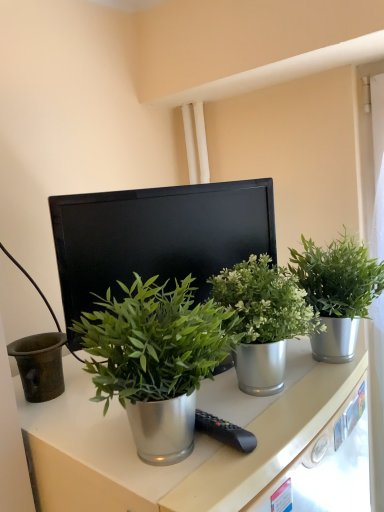
Question: From a real-world perspective, is green metallic plant at center, which is counted as the 3th houseplant, starting from the right, positioned over green metallic plant at center, which ranks as the third houseplant in left-to-right order, based on gravity?

Choices:
 (A) no
 (B) yes

Answer: (A)

Question: Is green metallic plant at center, which ranks as the first houseplant in left-to-right order, not close to green metallic plant at center, which ranks as the third houseplant in left-to-right order?

Choices:
 (A) yes
 (B) no

Answer: (B)

Question: Is green metallic plant at center, which is counted as the 3th houseplant, starting from the right, thinner than green metallic plant at center, which is the first houseplant from right to left?

Choices:
 (A) no
 (B) yes

Answer: (B)

Question: Is green metallic plant at center, which ranks as the first houseplant in left-to-right order, looking in the opposite direction of green metallic plant at center, which ranks as the third houseplant in left-to-right order?

Choices:
 (A) yes
 (B) no

Answer: (B)

Question: From a real-world perspective, is green metallic plant at center, which ranks as the first houseplant in left-to-right order, located beneath green metallic plant at center, which is the first houseplant from right to left?

Choices:
 (A) yes
 (B) no

Answer: (A)

Question: Based on their positions, is green metallic plant at center, which ranks as the third houseplant in left-to-right order, located to the left or right of black matte computer monitor at center?

Choices:
 (A) left
 (B) right

Answer: (B)

Question: Is green metallic plant at center, which is the first houseplant from right to left, situated inside black matte computer monitor at center or outside?

Choices:
 (A) outside
 (B) inside

Answer: (A)

Question: Is point (342, 254) closer or farther from the camera than point (84, 226)?

Choices:
 (A) closer
 (B) farther

Answer: (B)

Question: Looking at their shapes, would you say green metallic plant at center, which ranks as the third houseplant in left-to-right order, is wider or thinner than black matte computer monitor at center?

Choices:
 (A) wide
 (B) thin

Answer: (A)

Question: Considering the positions of metallic drawer at lower right and metallic green plant at center, which is counted as the 2th houseplant, starting from the left, in the image, is metallic drawer at lower right wider or thinner than metallic green plant at center, which is counted as the 2th houseplant, starting from the left,?

Choices:
 (A) thin
 (B) wide

Answer: (A)

Question: In terms of height, does metallic drawer at lower right look taller or shorter compared to metallic green plant at center, the second houseplant viewed from the right?

Choices:
 (A) tall
 (B) short

Answer: (B)

Question: Considering their positions, is metallic drawer at lower right located in front of or behind metallic green plant at center, which is counted as the 2th houseplant, starting from the left?

Choices:
 (A) front
 (B) behind

Answer: (A)

Question: In terms of size, does metallic drawer at lower right appear bigger or smaller than metallic green plant at center, which is counted as the 2th houseplant, starting from the left?

Choices:
 (A) big
 (B) small

Answer: (B)

Question: Looking at the image, does metallic green plant at center, the second houseplant viewed from the right, seem bigger or smaller compared to black matte computer monitor at center?

Choices:
 (A) big
 (B) small

Answer: (B)

Question: In terms of width, does metallic green plant at center, which is counted as the 2th houseplant, starting from the left, look wider or thinner when compared to black matte computer monitor at center?

Choices:
 (A) thin
 (B) wide

Answer: (B)